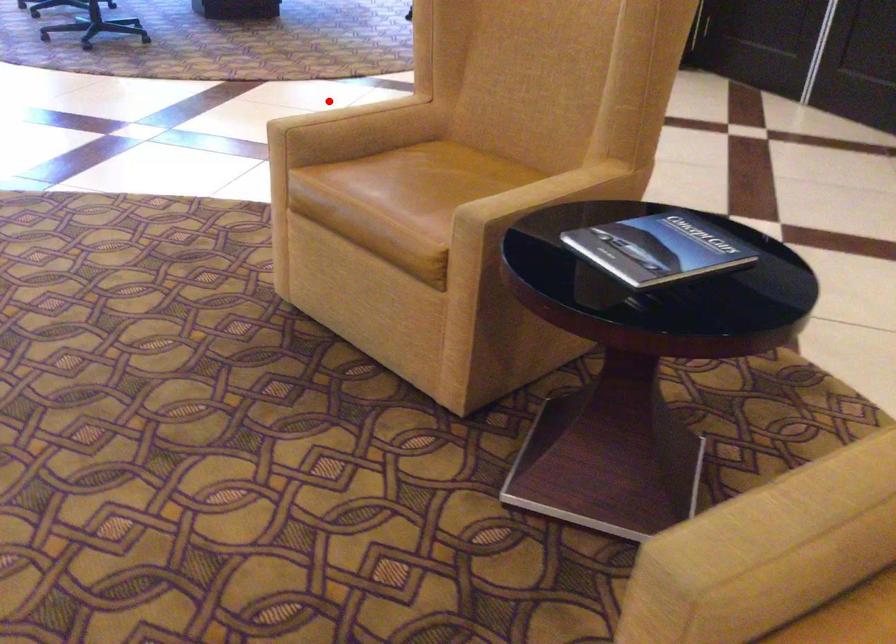
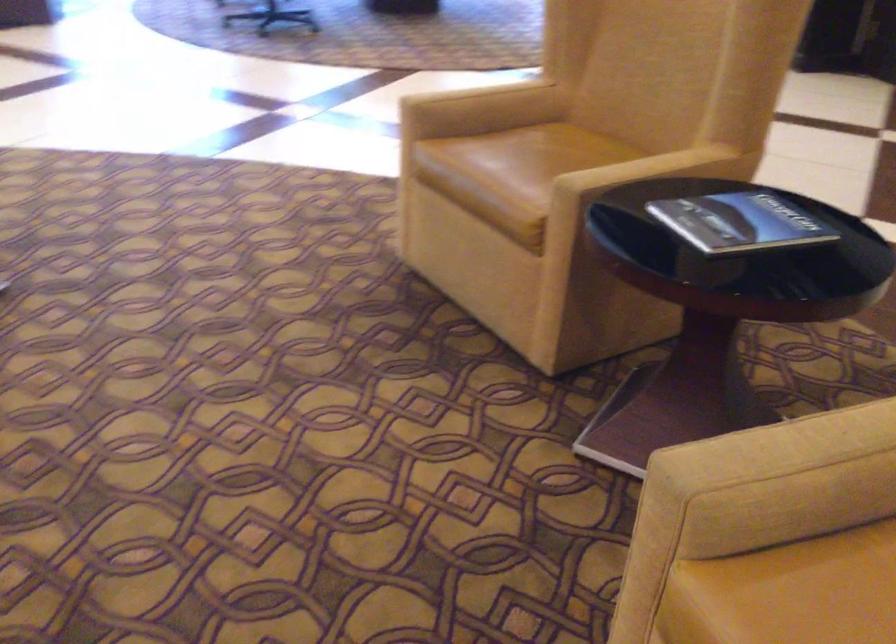
The point at the highlighted location is marked in the first image. Where is the corresponding point in the second image?

(478, 91)